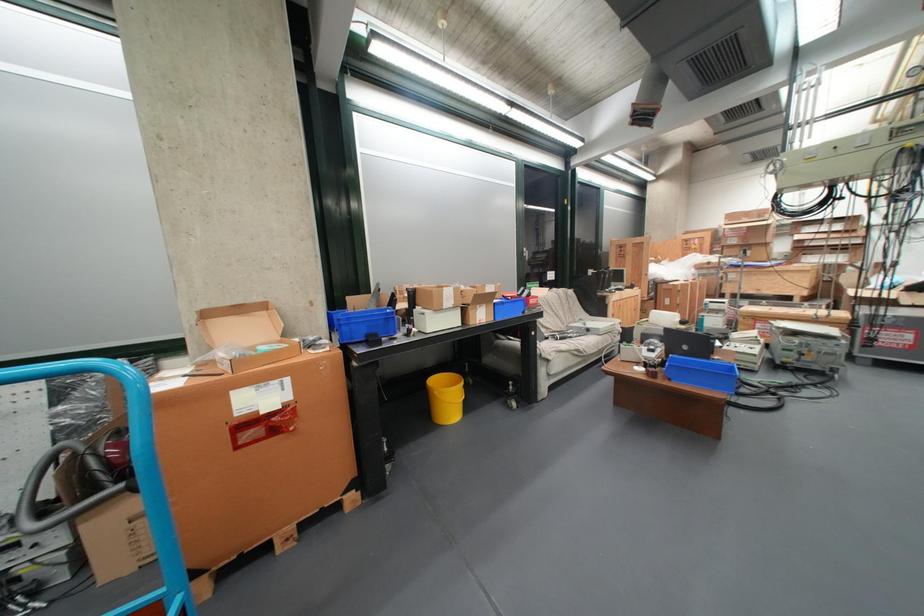
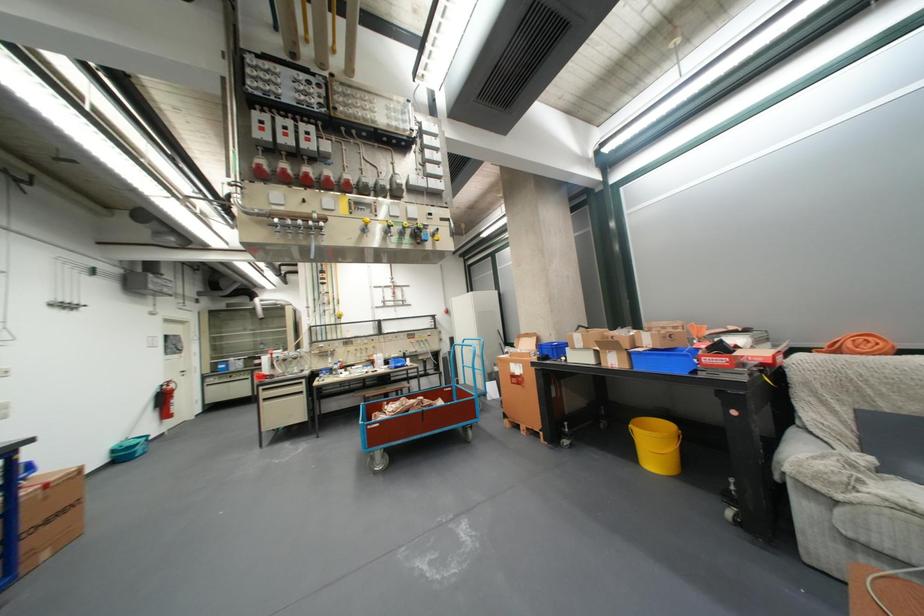
Locate, in the second image, the point that corresponds to the point at 504,320 in the first image.

(638, 368)